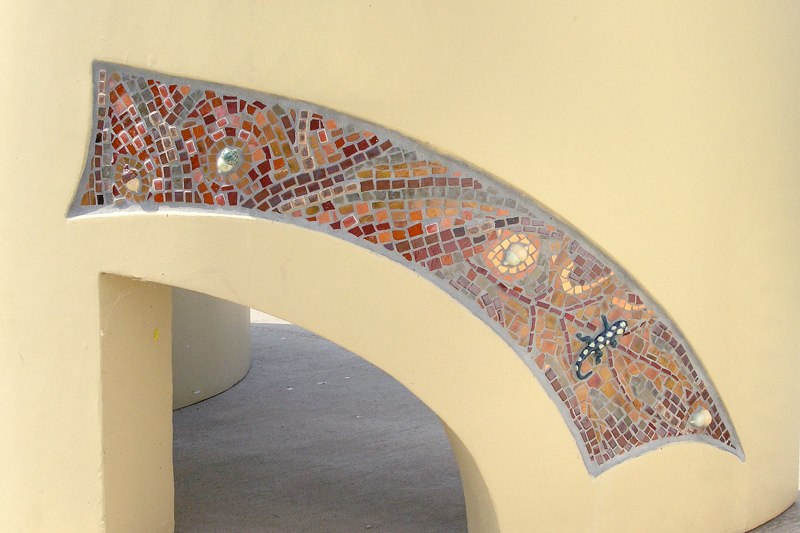
You are a GUI agent. You are given a task and a screenshot of the screen. Output one action in this format:
    pyautogui.click(x=<x>, y=<y>)
    Task: Click on the glass
    The height and width of the screenshot is (533, 800).
    Given the screenshot: What is the action you would take?
    pyautogui.click(x=294, y=159), pyautogui.click(x=602, y=369)